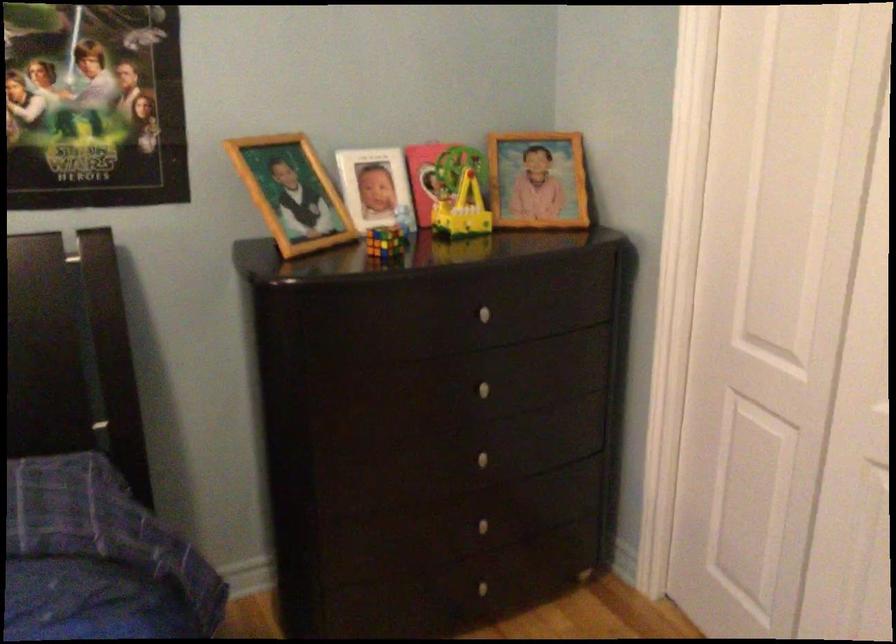
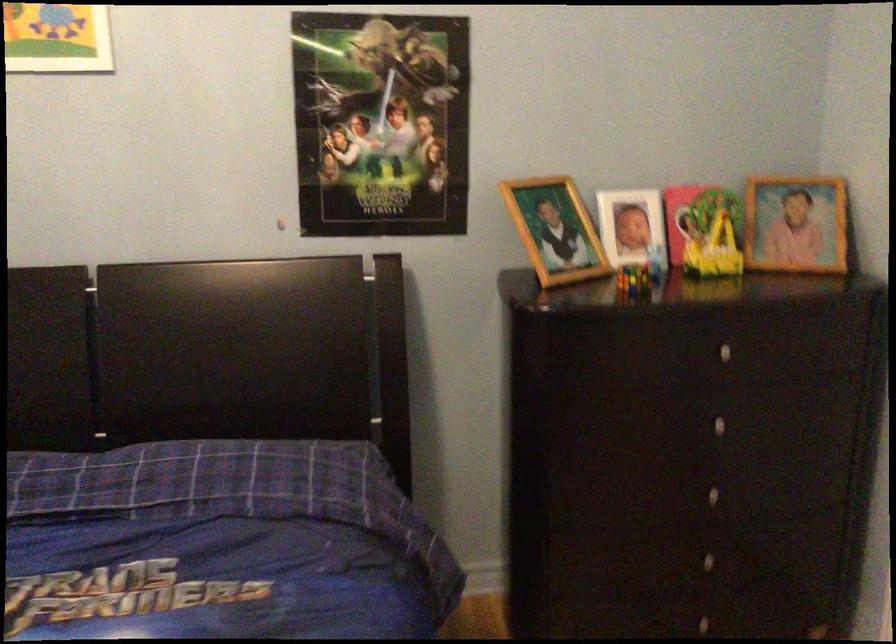
Question: How did the camera likely rotate?

Choices:
 (A) Left
 (B) Right
 (C) Up
 (D) Down

Answer: (A)